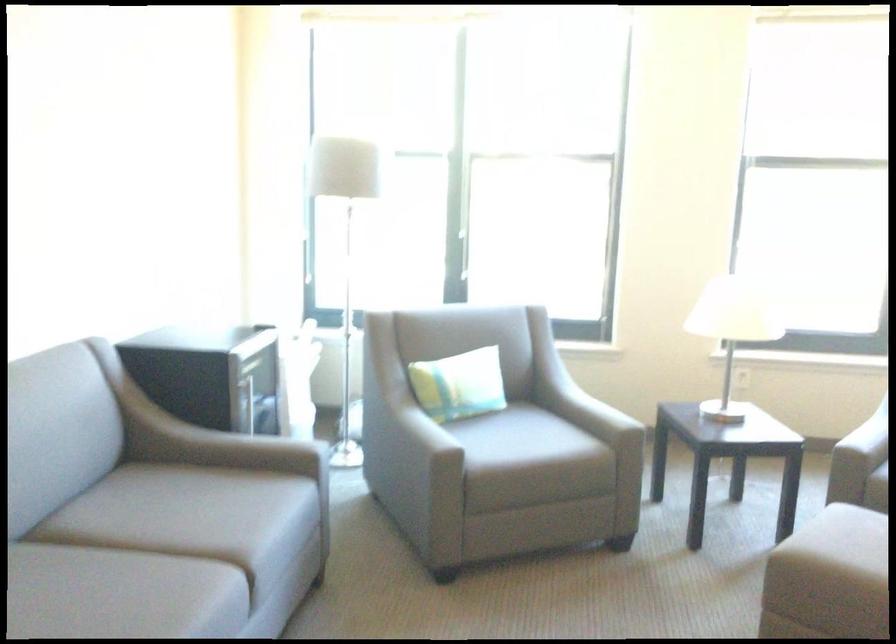
What are the coordinates of `chair sitting surface` in the screenshot? It's located at (119, 594).